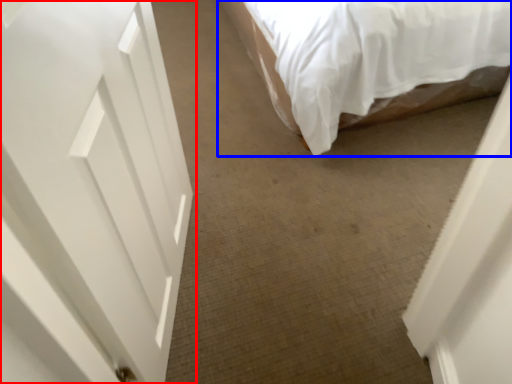
Question: Which point is closer to the camera, door (highlighted by a red box) or bed (highlighted by a blue box)?

Choices:
 (A) door
 (B) bed

Answer: (A)